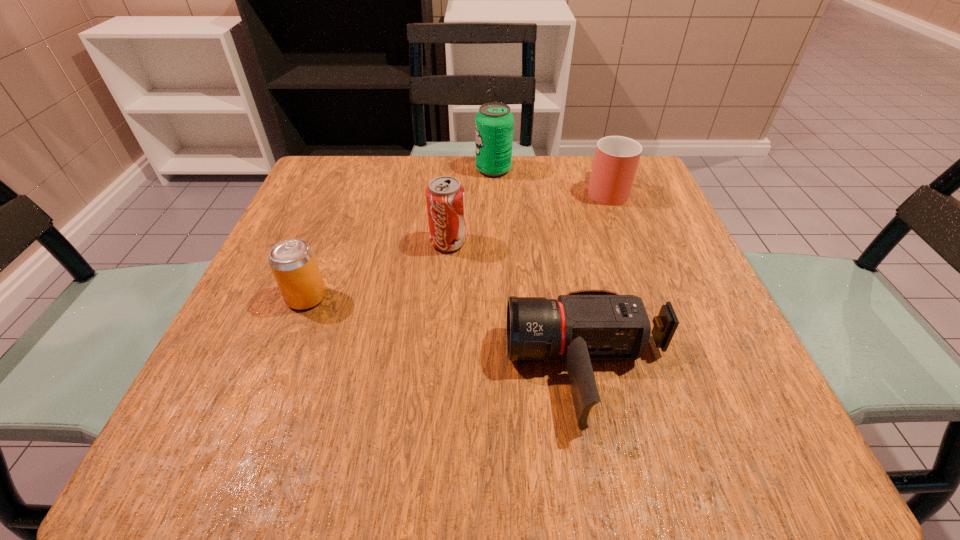
Locate which pop (soda) ranks in proximity to the leftmost object. Please provide its 2D coordinates. Your answer should be formatted as a tuple, i.e. [(x, y)], where the tuple contains the x and y coordinates of a point satisfying the conditions above.

[(445, 196)]

Find the location of a particular element. The width and height of the screenshot is (960, 540). vacant point that satisfies the following two spatial constraints: 1. on the back side of the second object from left to right; 2. on the left side of the shortest pop (soda) is located at coordinates (328, 242).